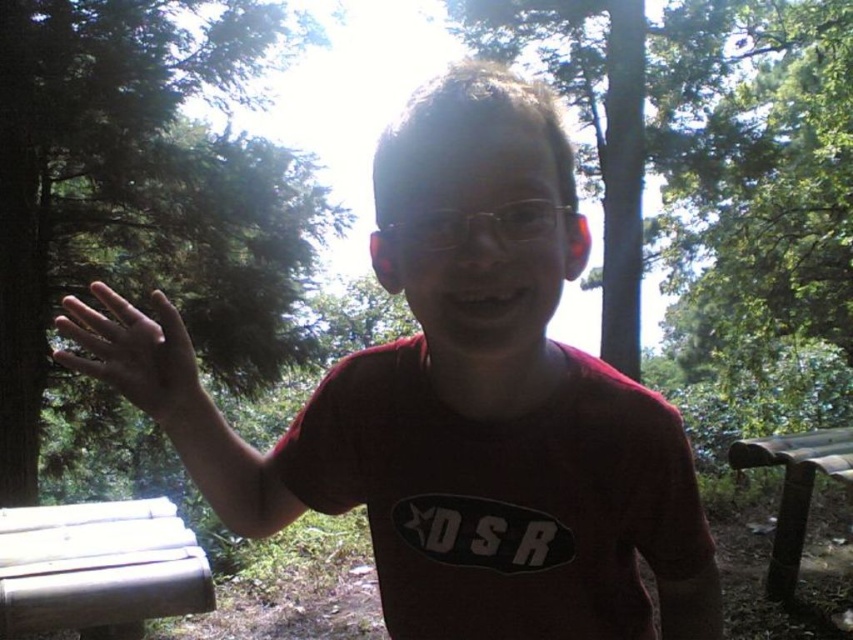
Question: Is smooth skin hand at left closer to camera compared to brown wooden bench at lower right?

Choices:
 (A) no
 (B) yes

Answer: (B)

Question: Which point appears closest to the camera in this image?

Choices:
 (A) tap(444, 234)
 (B) tap(180, 396)
 (C) tap(480, 252)

Answer: (C)

Question: Can you confirm if white wood bench at lower left is positioned to the right of clear plastic glasses at center?

Choices:
 (A) yes
 (B) no

Answer: (B)

Question: Which point is closer to the camera taking this photo?

Choices:
 (A) (798, 438)
 (B) (10, 330)
 (C) (451, 474)

Answer: (C)

Question: Is matte red t-shirt at center bigger than clear plastic glasses at center?

Choices:
 (A) yes
 (B) no

Answer: (A)

Question: Which object appears closest to the camera in this image?

Choices:
 (A) clear plastic glasses at center
 (B) green leafy tree at left
 (C) smooth skin hand at left

Answer: (A)